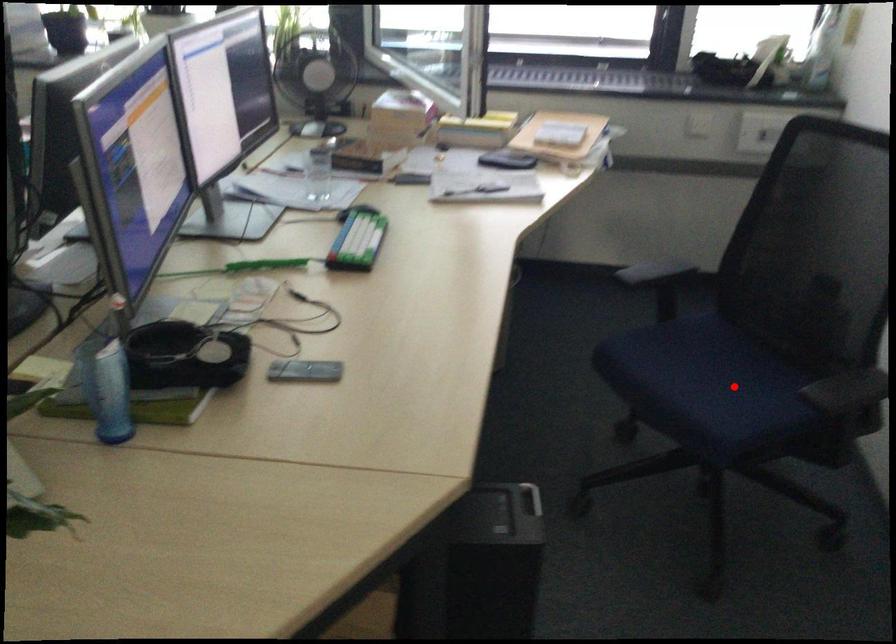
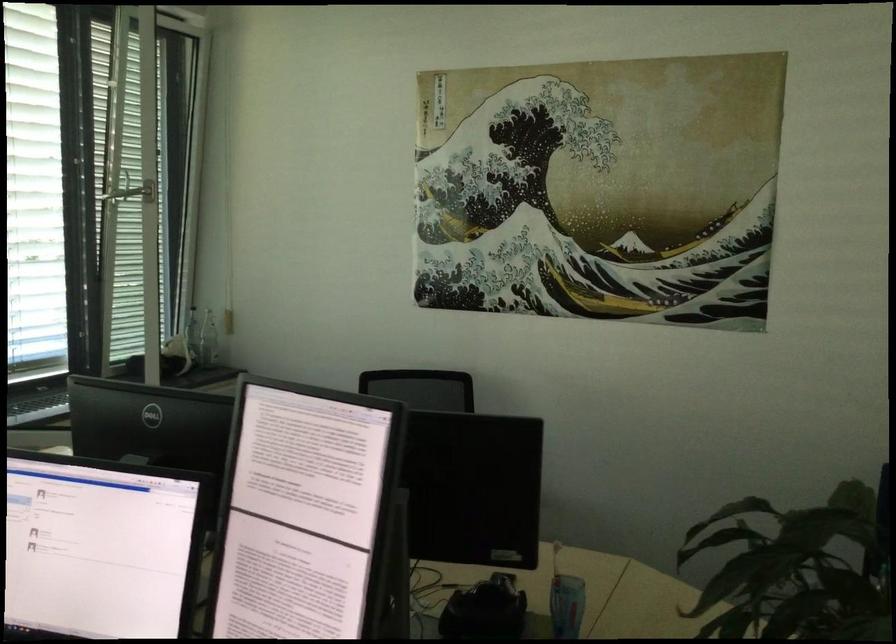
Question: I am providing you with two images of the same scene from different viewpoints. A red point is marked on the first image. At the location where the point appears in image 1, is it still visible in image 2?

Choices:
 (A) Yes
 (B) No

Answer: (B)